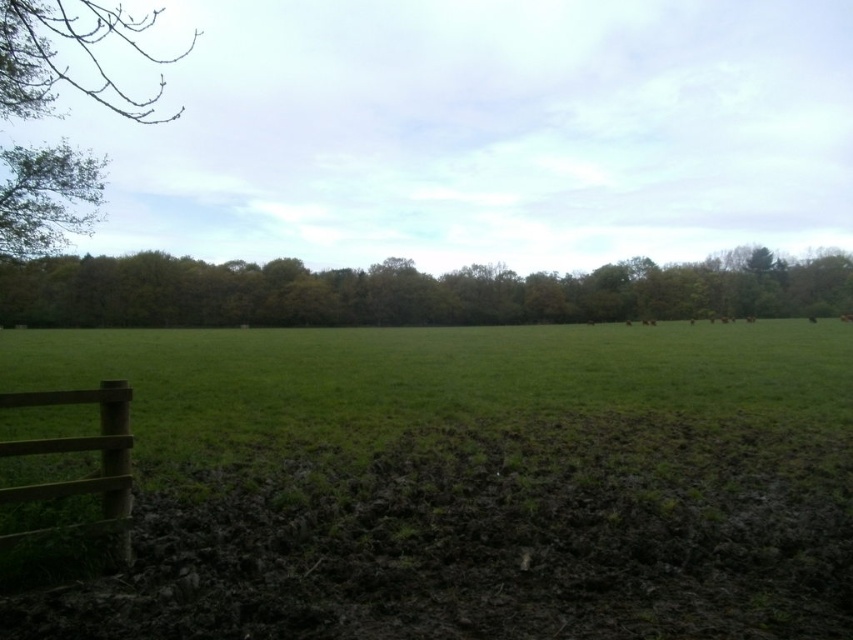
You are standing at the center of the field in the rural landscape. If you want to walk towards the green leafy tree at upper left, in which general direction should you head?

You should head towards the upper left direction to reach the green leafy tree at upper left, as it is located at point (68, 64).

Based on the scene description, what does the point at coordinates (405, 292) represent?

The point at coordinates (405, 292) represents the green leafy trees at upper center as per the scene description.

You are planning to plant a new tree in the rural landscape. The area has two existing trees visible in the image. Based on the scene, which tree, the green leafy trees at upper center or the green leafy tree at upper left, might require more space due to its width?

The green leafy trees at upper center might require more space due to its width compared to the green leafy tree at upper left.